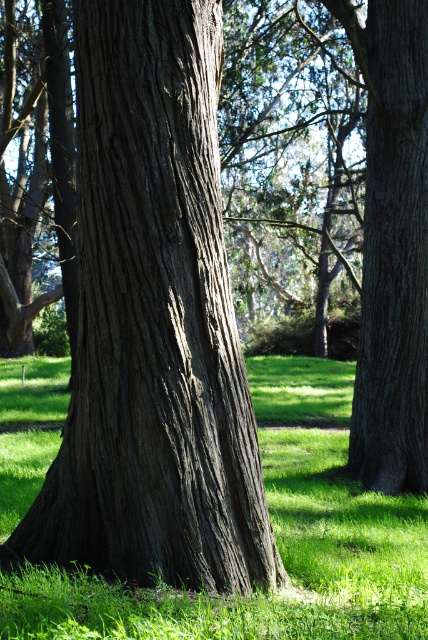
You are a gardener planning to plant a new flower bed between the green grassy at center and the dark brown textured tree trunk at center. Which area has more space to accommodate the flowers?

The green grassy at center has more space to accommodate the flowers since it is bigger than the dark brown textured tree trunk at center.

From the picture: You are standing in a natural setting with a large tree trunk and lush grass. There are two points marked in the scene. The first point is at coordinate point (50, 480) and the second is at point (288, 464). From your perspective, which point is closer to you?

Point (50, 480) is in front of point (288, 464), so it is closer to you.

You are standing in front of the tree and want to take a photo of both the point at coordinates point [21,579] and point [395,404]. Which point should you focus on first to ensure both are in focus?

You should focus on point [21,579] first because it is closer to the camera than point [395,404]. By focusing on the closer point, the farther point will also be within the depth of field.